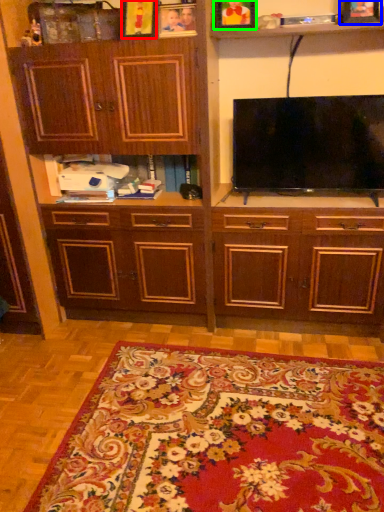
Question: Which object is the farthest from picture frame (highlighted by a red box)? Choose among these: picture frame (highlighted by a blue box) or picture frame (highlighted by a green box).

Choices:
 (A) picture frame
 (B) picture frame

Answer: (A)